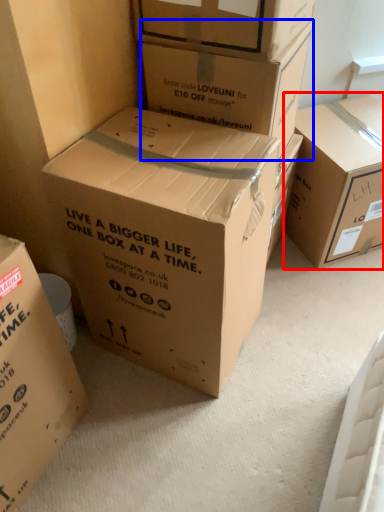
Question: Which object appears closest to the camera in this image, box (highlighted by a red box) or box (highlighted by a blue box)?

Choices:
 (A) box
 (B) box

Answer: (B)